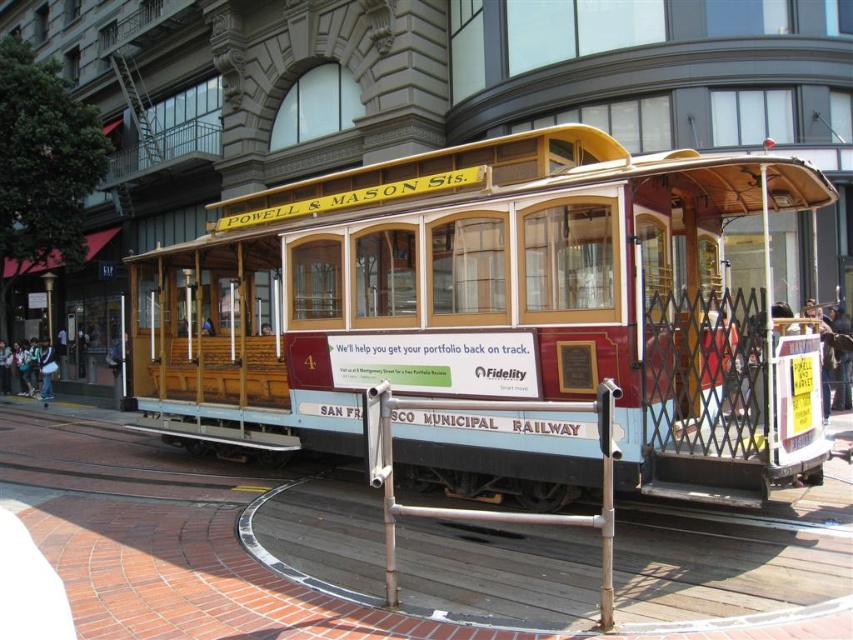
Based on the photo, you are standing in front of the cable car and want to take a photo. You notice two points marked on the track in front of you. The first point is at coordinate point (x=664, y=483), and the second point is at coordinate point (x=474, y=408). Which point is closer to your camera?

Point (x=664, y=483) is further to the camera than point (x=474, y=408), so the point closer to your camera is point (x=474, y=408).

You are standing in front of a model of a San Francisco cable car. The model has a point marked at coordinates (747, 396). If you want to place a small souvenir stand 5 meters away from this point, will it be within the circular track area?

The point at (747, 396) is 6.81 meters away from the viewer. Placing a souvenir stand 5 meters away from this point would mean it is 1.81 meters closer to the viewer than the point. Since the circular track is surrounded by a brick area, the stand would still be within the track area.

You are a tour guide explaining the layout of the cable car exhibit. You mention both the wooden cable car at center and the silver metallic rail at lower center. Which object is wider?

The wooden cable car at center is wider than the silver metallic rail at lower center.